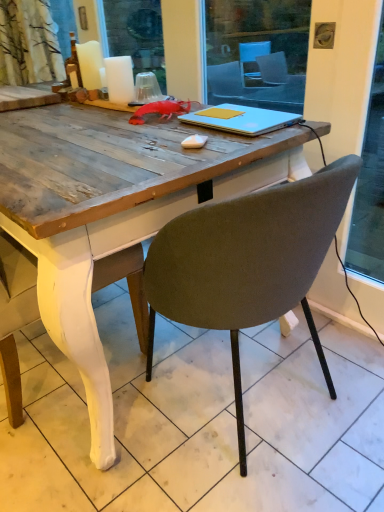
Where is `free point below matte gray chair at center (from a real-world perspective)`? The height and width of the screenshot is (512, 384). free point below matte gray chair at center (from a real-world perspective) is located at coordinates (232, 392).